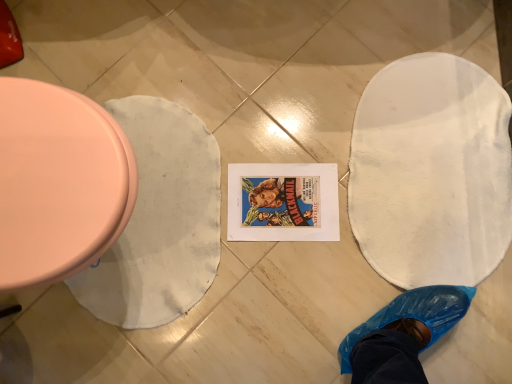
Find the location of a particular element. Image resolution: width=512 pixels, height=384 pixels. free location to the right of matte pink toilet at left is located at coordinates (264, 211).